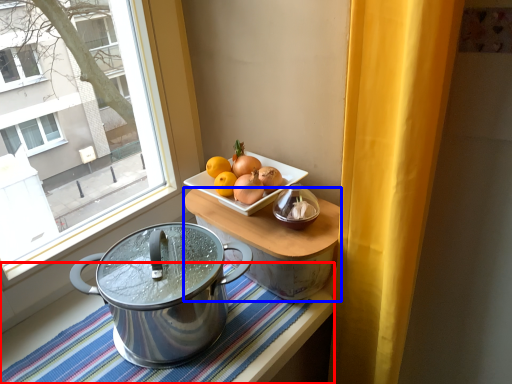
Question: Which object appears farthest to the camera in this image, tablecloth (highlighted by a red box) or table (highlighted by a blue box)?

Choices:
 (A) tablecloth
 (B) table

Answer: (B)